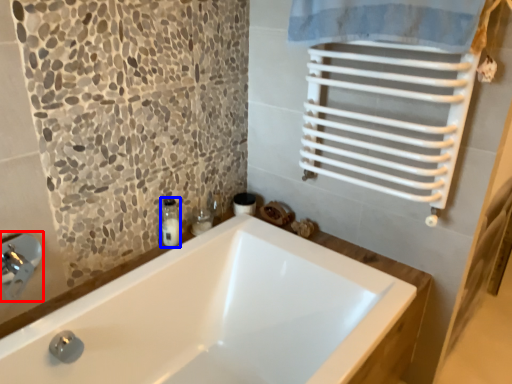
Question: Which object appears closest to the camera in this image, faucet (highlighted by a red box) or soap dispenser (highlighted by a blue box)?

Choices:
 (A) faucet
 (B) soap dispenser

Answer: (A)